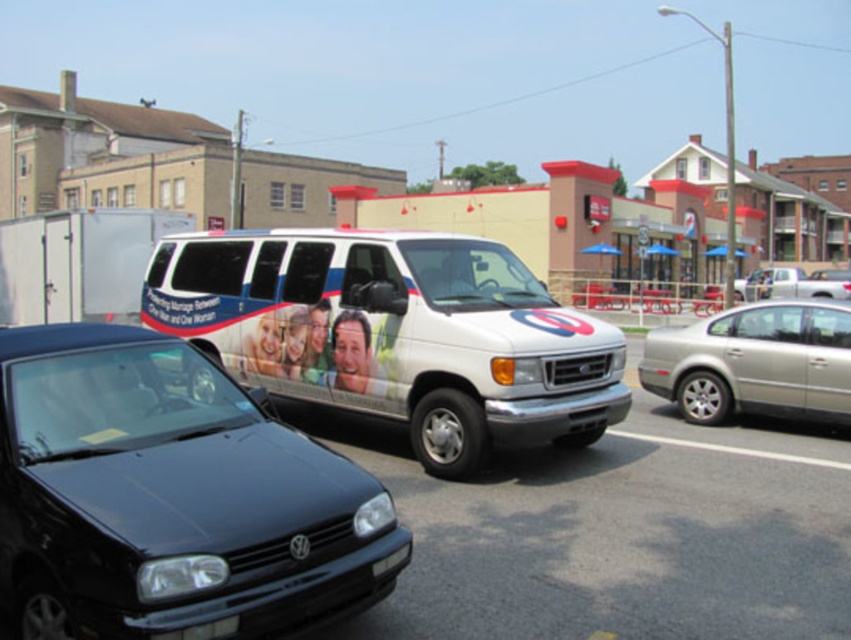
Looking at this image, measure the distance between point (317,502) and camera.

The distance of point (317,502) from camera is 3.54 meters.

Is point (297, 449) closer to viewer compared to point (515, 266)?

Yes, point (297, 449) is in front of point (515, 266).

Is point (216, 529) positioned before point (506, 401)?

Yes.

Locate an element on the screen. The width and height of the screenshot is (851, 640). black matte hatchback at lower left is located at coordinates (170, 499).

Who is lower down, black matte hatchback at lower left or silver metallic sedan at right?

black matte hatchback at lower left

Who is higher up, black matte hatchback at lower left or silver metallic sedan at right?

silver metallic sedan at right

Between point (124, 488) and point (752, 317), which one is positioned in front?

Positioned in front is point (124, 488).

Identify the location of black matte hatchback at lower left. (170, 499).

Is point (255, 291) behind point (701, 387)?

No.

You are a GUI agent. You are given a task and a screenshot of the screen. Output one action in this format:
    pyautogui.click(x=<x>, y=<y>)
    Task: Click on the white glossy van at center
    This screenshot has height=640, width=851.
    Given the screenshot: What is the action you would take?
    pyautogui.click(x=395, y=333)